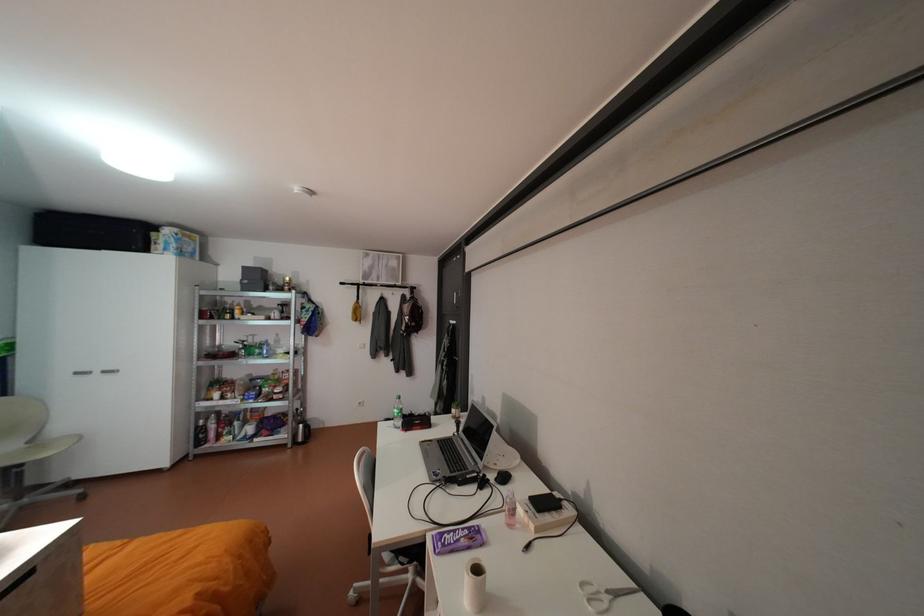
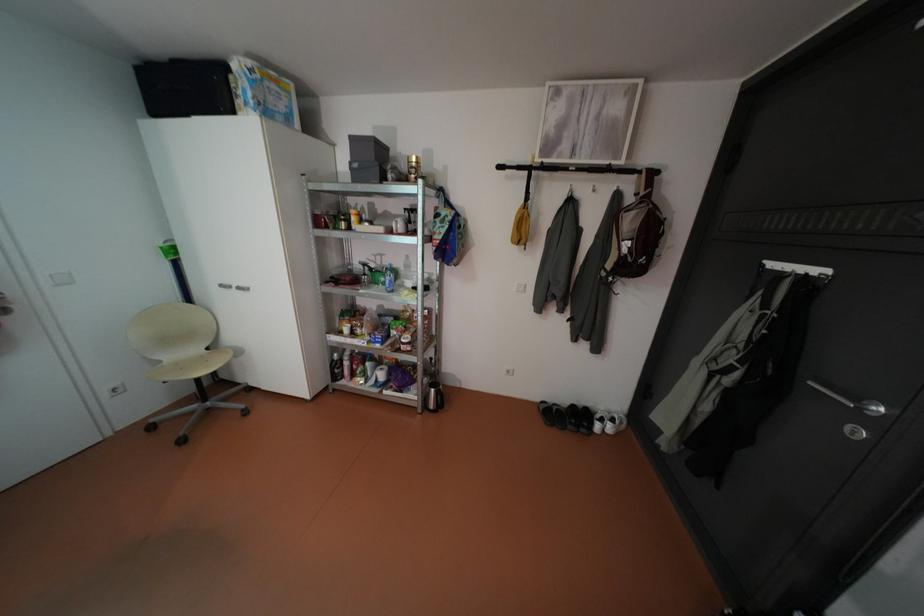
Locate, in the second image, the point that corresponds to point (310, 439) in the first image.

(441, 405)